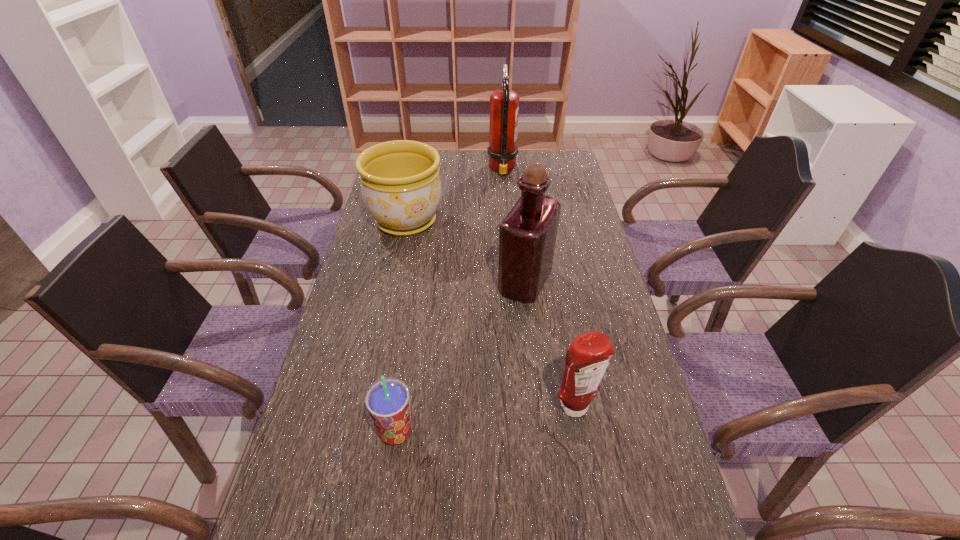
Image resolution: width=960 pixels, height=540 pixels. Find the location of `vacant space that satisfies the following two spatial constraints: 1. at the nozzle of the condiment; 2. on the left side of the farthest object`. vacant space that satisfies the following two spatial constraints: 1. at the nozzle of the condiment; 2. on the left side of the farthest object is located at coordinates (519, 407).

The height and width of the screenshot is (540, 960). I want to click on free space in the image that satisfies the following two spatial constraints: 1. at the nozzle of the third nearest object; 2. on the left side of the farthest object, so click(x=511, y=282).

You are a GUI agent. You are given a task and a screenshot of the screen. Output one action in this format:
    pyautogui.click(x=<x>, y=<y>)
    Task: Click on the free space in the image that satisfies the following two spatial constraints: 1. at the nozzle of the farthest object; 2. on the left side of the condiment
    
    Given the screenshot: What is the action you would take?
    pyautogui.click(x=519, y=407)